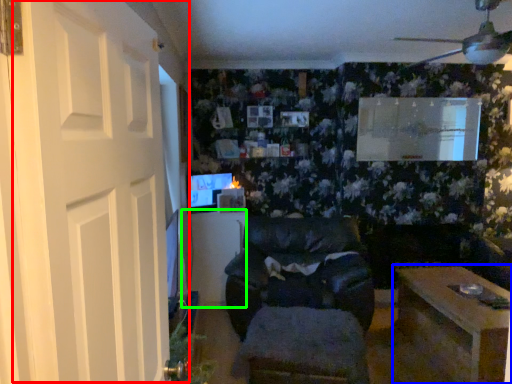
Question: Which object is the closest to the door (highlighted by a red box)? Choose among these: table (highlighted by a blue box) or table (highlighted by a green box).

Choices:
 (A) table
 (B) table

Answer: (A)